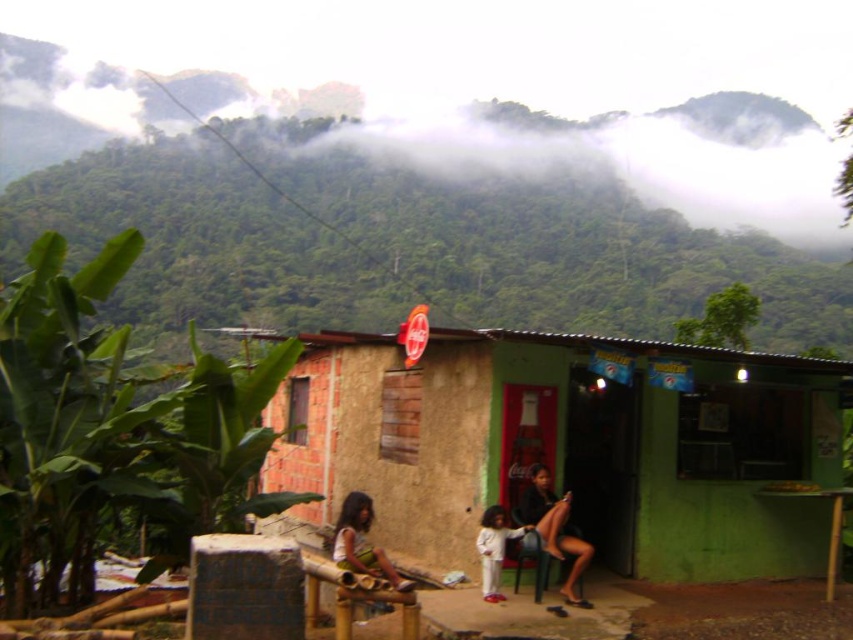
You are a tailor who needs to determine if the matte black dress at center can be placed on the light brown wooden bench at lower center without exceeding its width. Based on the scene description, can the dress fit on the bench?

The matte black dress at center is narrower than the light brown wooden bench at lower center, so it can fit on the bench without exceeding its width.

You are standing in front of the rustic building with the Coca Cola logo. There is a point marked at coordinates (569, 444). Based on the scene description, where is this point located?

The point at coordinates (569, 444) is located on the green corrugated metal hut at center.